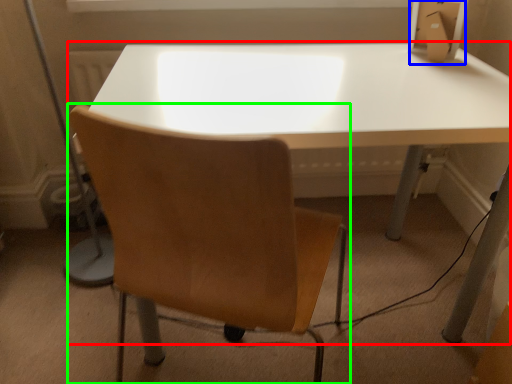
Question: Which object is positioned farthest from table (highlighted by a red box)? Select from cardboard box (highlighted by a blue box) and chair (highlighted by a green box).

Choices:
 (A) cardboard box
 (B) chair

Answer: (A)